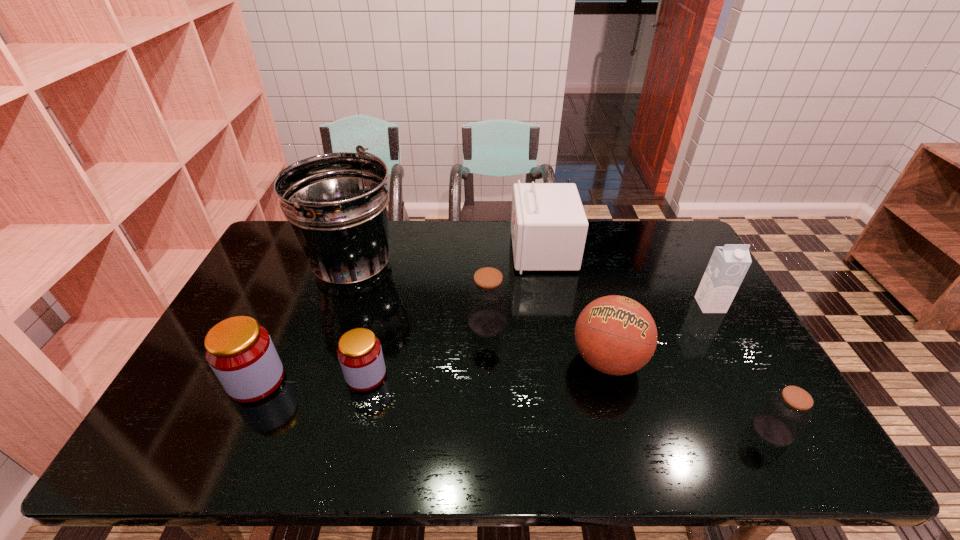
The image size is (960, 540). I want to click on the nearest object, so click(x=785, y=413).

Image resolution: width=960 pixels, height=540 pixels. I want to click on the smaller brown jar, so click(x=785, y=413).

Where is `vacant position located 0.110m on the front of the tallest object`? vacant position located 0.110m on the front of the tallest object is located at coordinates (331, 331).

Find the location of `free location located 0.370m on the front-facing side of the first-aid kit`. free location located 0.370m on the front-facing side of the first-aid kit is located at coordinates (407, 251).

The width and height of the screenshot is (960, 540). In order to click on vacant space located on the front-facing side of the first-aid kit in this screenshot , I will do `click(398, 251)`.

Locate an element on the screen. The width and height of the screenshot is (960, 540). free space located on the front-facing side of the first-aid kit is located at coordinates (436, 251).

You are a GUI agent. You are given a task and a screenshot of the screen. Output one action in this format:
    pyautogui.click(x=<x>, y=<y>)
    Task: Click on the vacant space located 0.260m on the front label of the carton
    This screenshot has width=960, height=540.
    Given the screenshot: What is the action you would take?
    pyautogui.click(x=756, y=386)

What are the coordinates of `vacant space located on the back of the basketball` in the screenshot? It's located at (585, 277).

Find the location of a particular element. free space located 0.110m on the left of the left brown jar is located at coordinates [431, 323].

Locate an element on the screen. The image size is (960, 540). vacant area situated on the back of the left red jar is located at coordinates (302, 278).